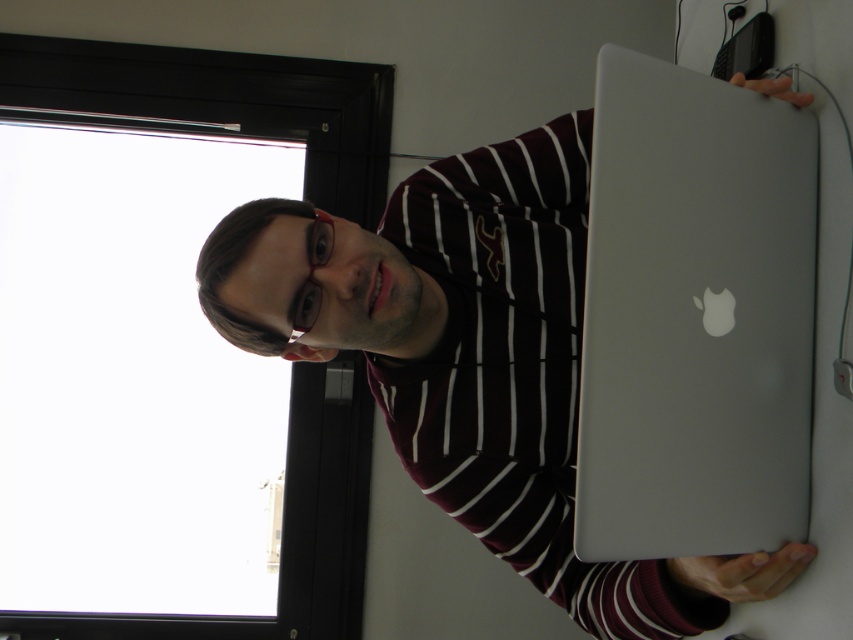
Question: Does silver metallic laptop at upper right have a larger size compared to sleek silver laptop at center?

Choices:
 (A) yes
 (B) no

Answer: (A)

Question: Does silver metallic laptop at upper right lie in front of sleek silver laptop at center?

Choices:
 (A) yes
 (B) no

Answer: (B)

Question: Which point is farther to the camera?

Choices:
 (A) (527, 420)
 (B) (689, 454)

Answer: (A)

Question: Does silver metallic laptop at upper right appear on the right side of sleek silver laptop at center?

Choices:
 (A) no
 (B) yes

Answer: (A)